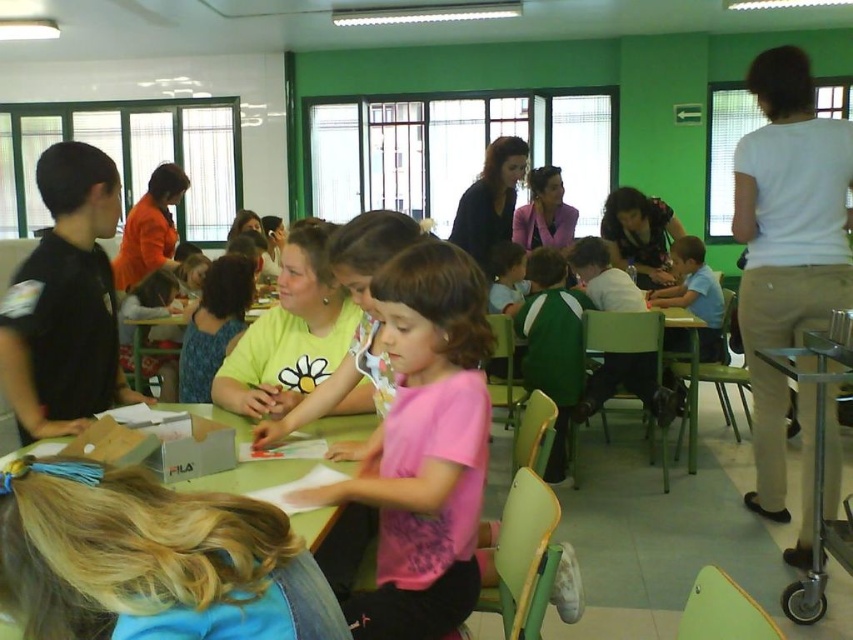
Measure the distance between pink matte shirt at center and camera.

pink matte shirt at center is 1.44 meters away from camera.

Describe the element at coordinates (425, 448) in the screenshot. I see `pink matte shirt at center` at that location.

Which is in front, point (424, 570) or point (780, 481)?

Positioned in front is point (424, 570).

At what (x,y) coordinates should I click in order to perform the action: click on pink matte shirt at center. Please return your answer as a coordinate pair (x, y). Image resolution: width=853 pixels, height=640 pixels. Looking at the image, I should click on (425, 448).

Does pink matte shirt at center have a lesser width compared to green plastic table at center?

Correct, pink matte shirt at center's width is less than green plastic table at center's.

Does pink matte shirt at center have a greater width compared to green plastic table at center?

No, pink matte shirt at center is not wider than green plastic table at center.

Image resolution: width=853 pixels, height=640 pixels. What are the coordinates of `pink matte shirt at center` in the screenshot? It's located at (425, 448).

Is white cotton shirt at right shorter than green plastic table at center?

In fact, white cotton shirt at right may be taller than green plastic table at center.

Is white cotton shirt at right positioned behind green plastic table at center?

Yes, white cotton shirt at right is further from the viewer.

Who is more distant from viewer, (x=735, y=209) or (x=230, y=483)?

Positioned behind is point (x=735, y=209).

At what (x,y) coordinates should I click in order to perform the action: click on white cotton shirt at right. Please return your answer as a coordinate pair (x, y). This screenshot has height=640, width=853. Looking at the image, I should click on [787, 243].